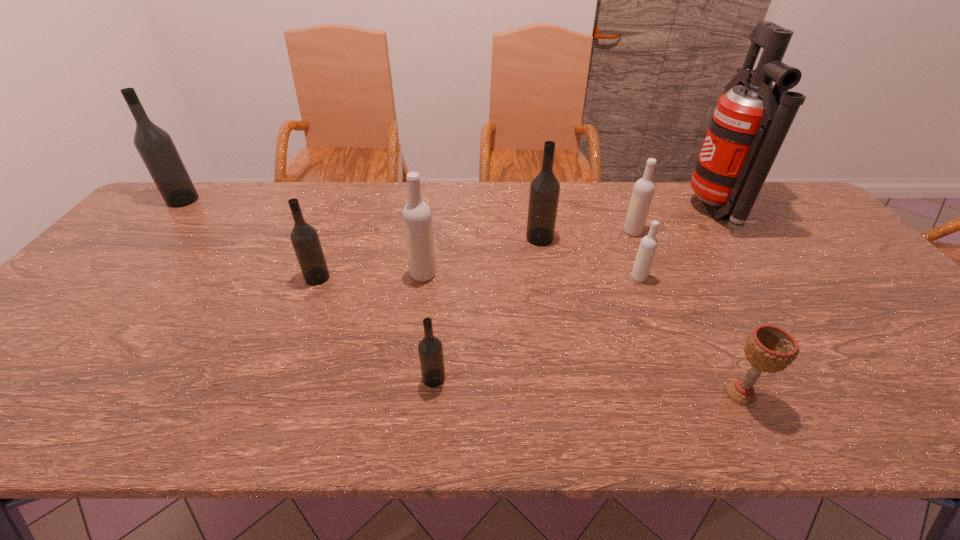
This screenshot has width=960, height=540. Identify the location of the rightmost object. (750, 122).

You are a GUI agent. You are given a task and a screenshot of the screen. Output one action in this format:
    pyautogui.click(x=<x>, y=<y>)
    Task: Click on the red fire extinguisher
    
    Given the screenshot: What is the action you would take?
    pyautogui.click(x=750, y=122)

The height and width of the screenshot is (540, 960). What are the coordinates of `the second tallest object` in the screenshot? It's located at (155, 146).

At what (x,y) coordinates should I click in order to perform the action: click on the leftmost black vodka. Please return your answer as a coordinate pair (x, y). This screenshot has height=540, width=960. Looking at the image, I should click on (155, 146).

This screenshot has width=960, height=540. Find the location of `the third smallest black vodka`. the third smallest black vodka is located at coordinates (544, 190).

You are a GUI agent. You are given a task and a screenshot of the screen. Output one action in this format:
    pyautogui.click(x=<x>, y=<y>)
    Task: Click on the second farthest black vodka
    This screenshot has height=540, width=960.
    Given the screenshot: What is the action you would take?
    pyautogui.click(x=544, y=190)

Where is `the biggest white vodka`? the biggest white vodka is located at coordinates (417, 218).

What are the coordinates of `the second biggest white vodka` in the screenshot? It's located at (644, 188).

The width and height of the screenshot is (960, 540). I want to click on the third black vodka from right to left, so click(x=305, y=240).

Identify the location of the sixth vodka from right to left. The height and width of the screenshot is (540, 960). (305, 240).